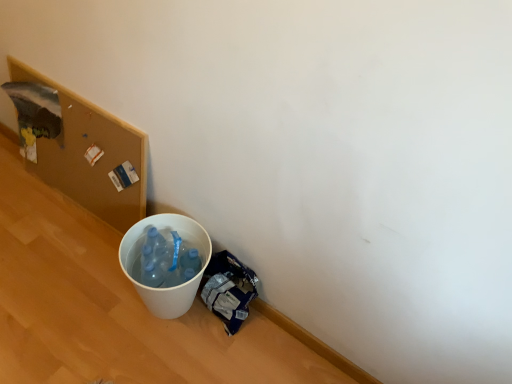
Question: Is blue plastic bag at lower right facing away from white plastic bucket at lower left?

Choices:
 (A) no
 (B) yes

Answer: (A)

Question: Is blue plastic bag at lower right closer to the viewer compared to white plastic bucket at lower left?

Choices:
 (A) yes
 (B) no

Answer: (B)

Question: From the image's perspective, is blue plastic bag at lower right on white plastic bucket at lower left?

Choices:
 (A) yes
 (B) no

Answer: (B)

Question: Considering the relative positions of blue plastic bag at lower right and white plastic bucket at lower left in the image provided, is blue plastic bag at lower right to the left of white plastic bucket at lower left from the viewer's perspective?

Choices:
 (A) yes
 (B) no

Answer: (B)

Question: Considering the relative positions of blue plastic bag at lower right and white plastic bucket at lower left in the image provided, is blue plastic bag at lower right to the right of white plastic bucket at lower left from the viewer's perspective?

Choices:
 (A) no
 (B) yes

Answer: (B)

Question: Is white plastic bucket at lower left inside or outside of blue plastic bag at lower right?

Choices:
 (A) outside
 (B) inside

Answer: (A)

Question: In terms of size, does white plastic bucket at lower left appear bigger or smaller than blue plastic bag at lower right?

Choices:
 (A) big
 (B) small

Answer: (A)

Question: Considering the positions of white plastic bucket at lower left and blue plastic bag at lower right in the image, is white plastic bucket at lower left wider or thinner than blue plastic bag at lower right?

Choices:
 (A) wide
 (B) thin

Answer: (A)

Question: Considering the positions of white plastic bucket at lower left and blue plastic bag at lower right in the image, is white plastic bucket at lower left taller or shorter than blue plastic bag at lower right?

Choices:
 (A) short
 (B) tall

Answer: (B)

Question: Choose the correct answer: Is white plastic bucket at lower left inside wooden corkboard at upper left or outside it?

Choices:
 (A) inside
 (B) outside

Answer: (B)

Question: Considering the positions of point (119, 261) and point (11, 69), is point (119, 261) closer or farther from the camera than point (11, 69)?

Choices:
 (A) closer
 (B) farther

Answer: (A)

Question: In terms of width, does white plastic bucket at lower left look wider or thinner when compared to wooden corkboard at upper left?

Choices:
 (A) thin
 (B) wide

Answer: (B)

Question: In the image, is white plastic bucket at lower left positioned in front of or behind wooden corkboard at upper left?

Choices:
 (A) front
 (B) behind

Answer: (A)

Question: Is wooden corkboard at upper left wider or thinner than blue plastic bag at lower right?

Choices:
 (A) wide
 (B) thin

Answer: (B)

Question: From the image's perspective, is wooden corkboard at upper left located above or below blue plastic bag at lower right?

Choices:
 (A) below
 (B) above

Answer: (B)